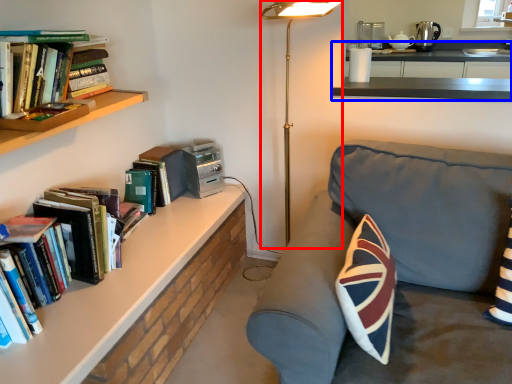
Question: Which object is closer to the camera taking this photo, table lamp (highlighted by a red box) or counter (highlighted by a blue box)?

Choices:
 (A) table lamp
 (B) counter

Answer: (A)